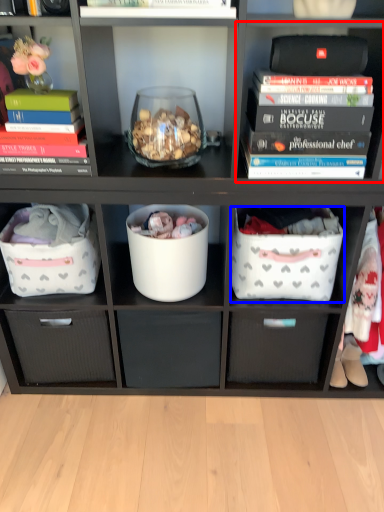
Question: Which object is closer to the camera taking this photo, shelf (highlighted by a red box) or laundry basket (highlighted by a blue box)?

Choices:
 (A) shelf
 (B) laundry basket

Answer: (A)